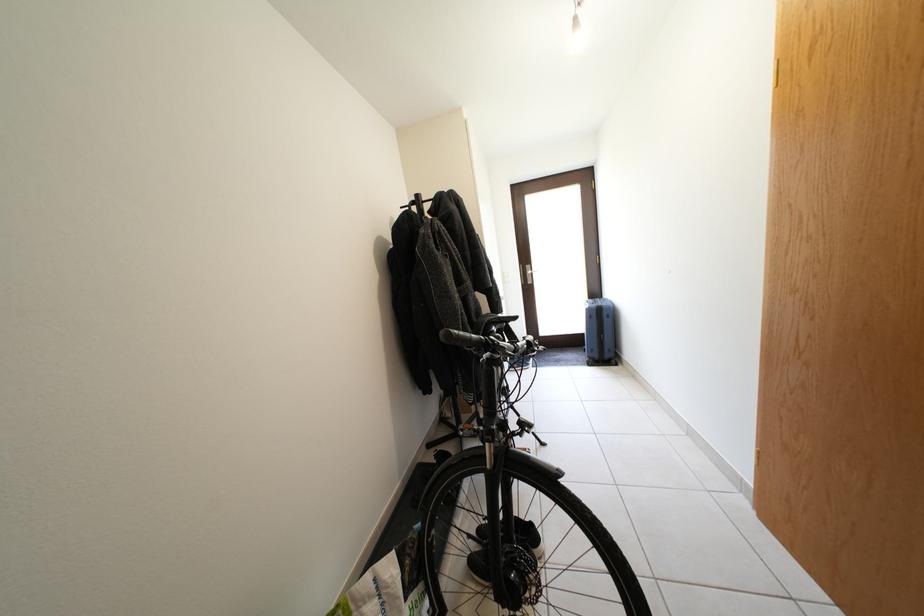
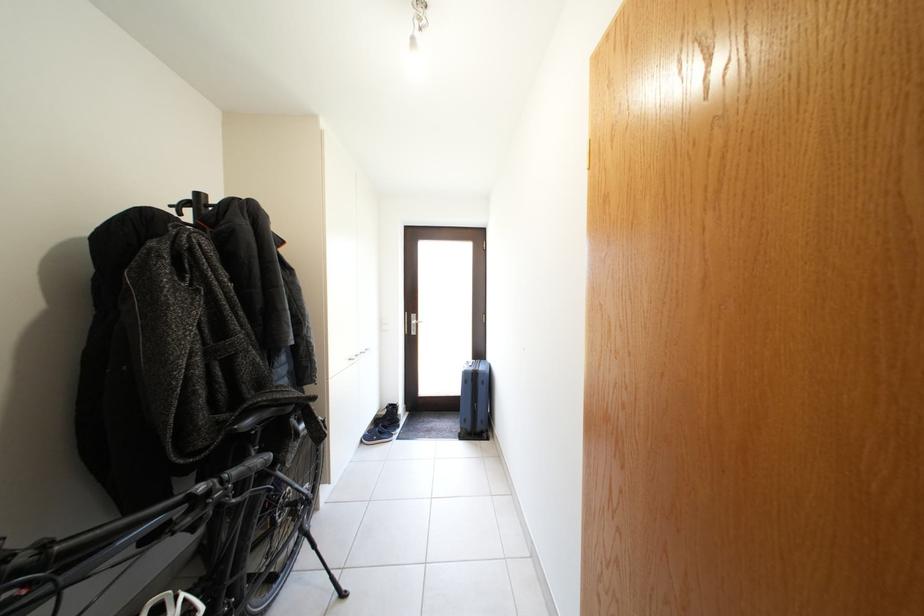
Find the pixel in the second image that matches (536,273) in the first image.

(421, 322)